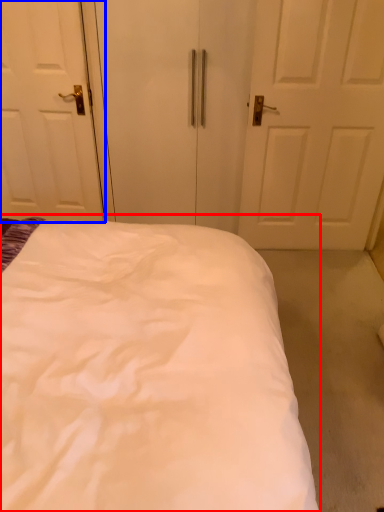
Question: Which point is closer to the camera, bed (highlighted by a red box) or door (highlighted by a blue box)?

Choices:
 (A) bed
 (B) door

Answer: (A)